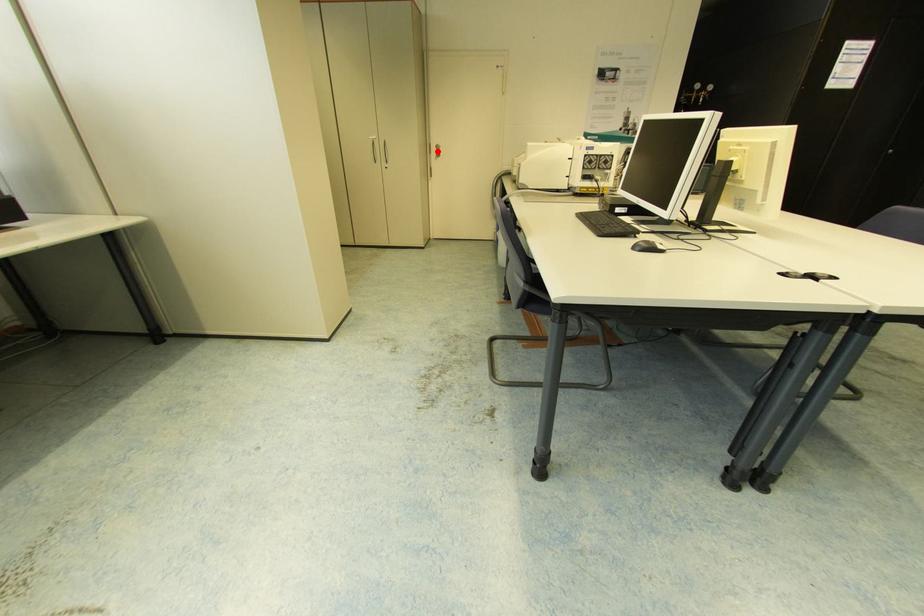
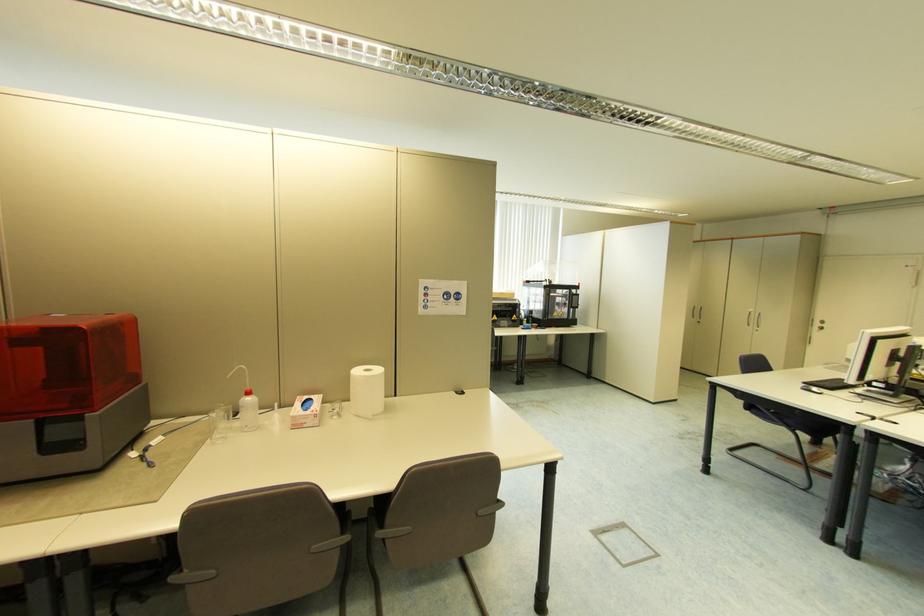
Question: I am providing you with two images of the same scene from different viewpoints. Image1 has a red point marked. In image2, the corresponding 3D location appears at what relative position? Reply with the corresponding letter.

Choices:
 (A) Closer
 (B) Farther

Answer: (B)